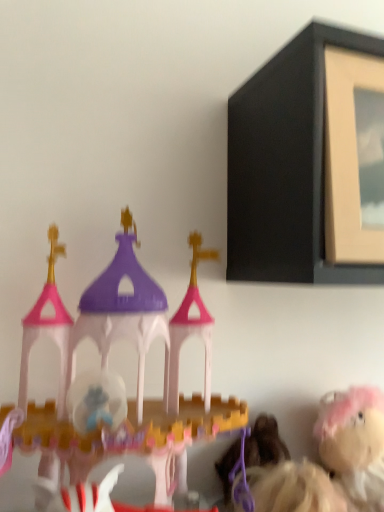
Question: Based on their sizes in the image, would you say matte plastic castle at left, arranged as the 1th toy when viewed from the left, is bigger or smaller than matte black picture frame at upper right?

Choices:
 (A) big
 (B) small

Answer: (B)

Question: From a real-world perspective, relative to matte black picture frame at upper right, is matte plastic castle at left, the 2th toy from the right, vertically above or below?

Choices:
 (A) above
 (B) below

Answer: (B)

Question: Which of these objects is positioned closest to the fluffy pink plush at lower right, which is the 2th toy in left-to-right order?

Choices:
 (A) matte plastic castle at left, arranged as the 1th toy when viewed from the left
 (B) matte black picture frame at upper right

Answer: (A)

Question: Estimate the real-world distances between objects in this image. Which object is farther from the matte plastic castle at left, arranged as the 2th toy when viewed from the back?

Choices:
 (A) matte black picture frame at upper right
 (B) fluffy pink plush at lower right, the first toy viewed from the right

Answer: (B)